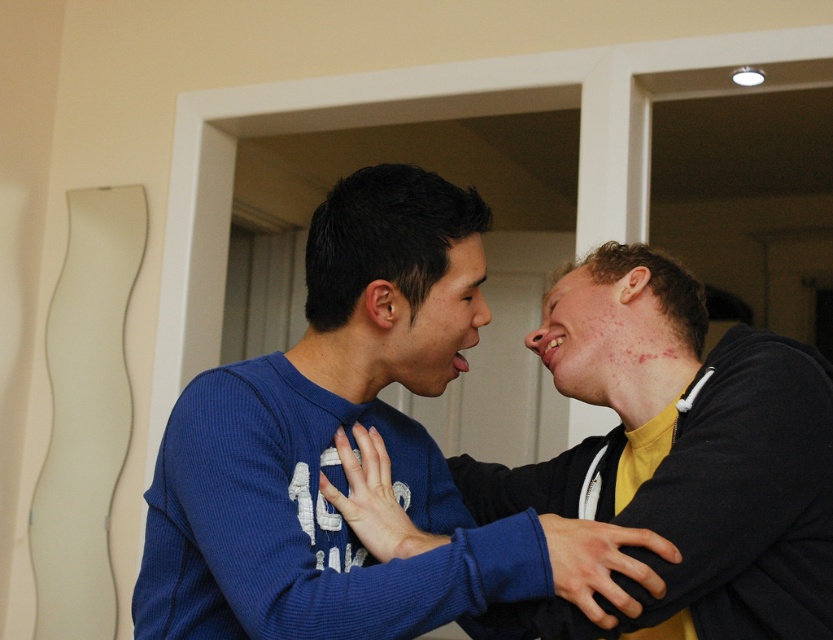
Does blue thermal sweater at center have a lesser height compared to matte blue sweater at center?

No.

Can you confirm if blue thermal sweater at center is thinner than matte blue sweater at center?

Indeed, blue thermal sweater at center has a lesser width compared to matte blue sweater at center.

Who is more distant from viewer, (252,588) or (686,420)?

The point (686,420) is more distant.

I want to click on blue thermal sweater at center, so click(x=333, y=449).